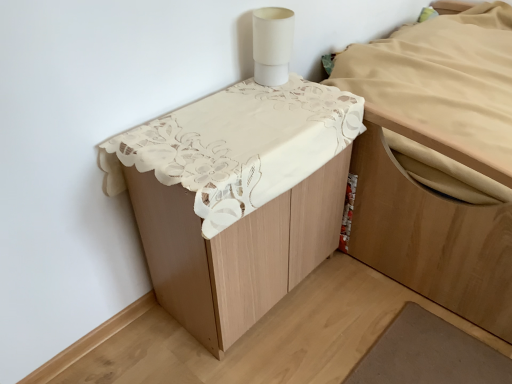
The width and height of the screenshot is (512, 384). I want to click on empty space that is ontop of white lace tablecloth at upper center, acting as the second furniture starting from the right (from a real-world perspective), so click(247, 117).